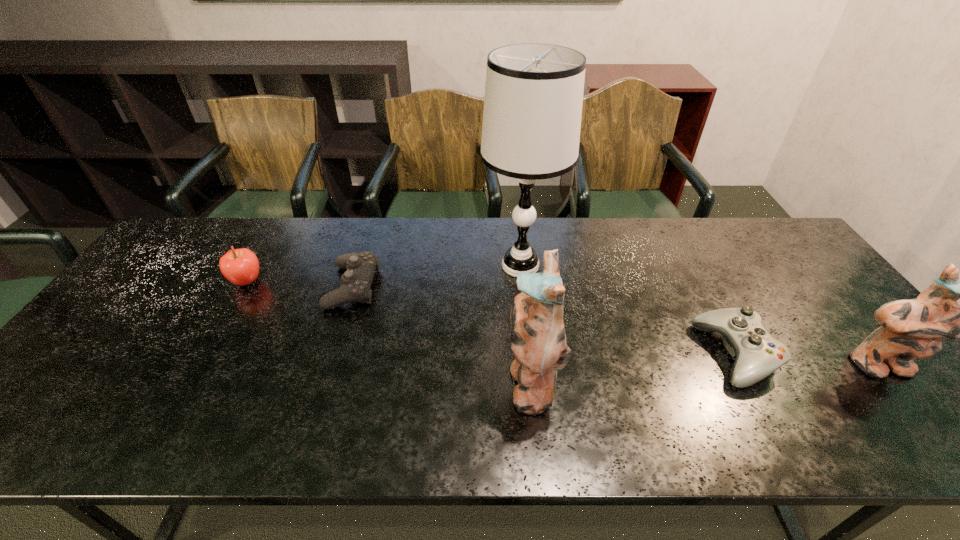
Identify the location of free point that keeps the figurines evenly spaced on the left. The image size is (960, 540). (158, 400).